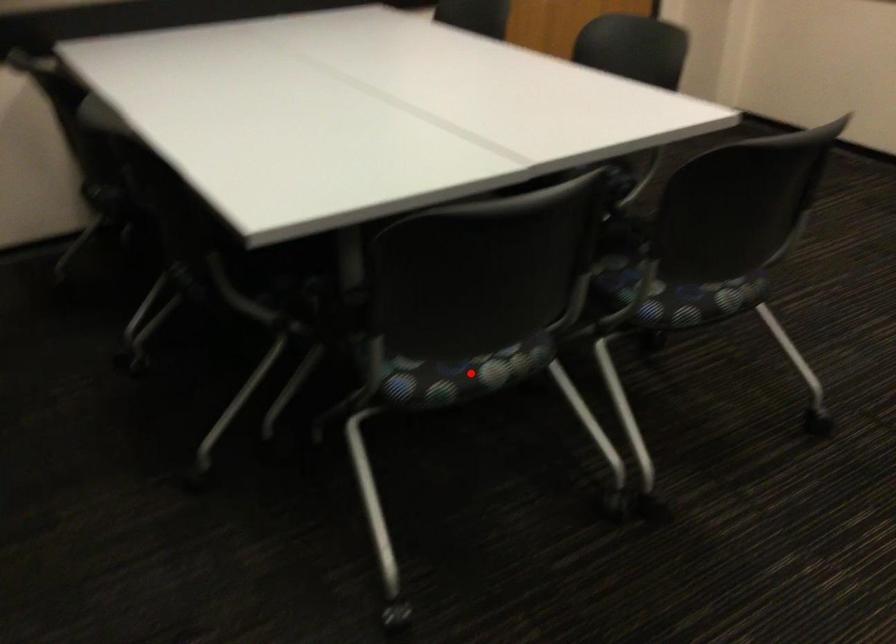
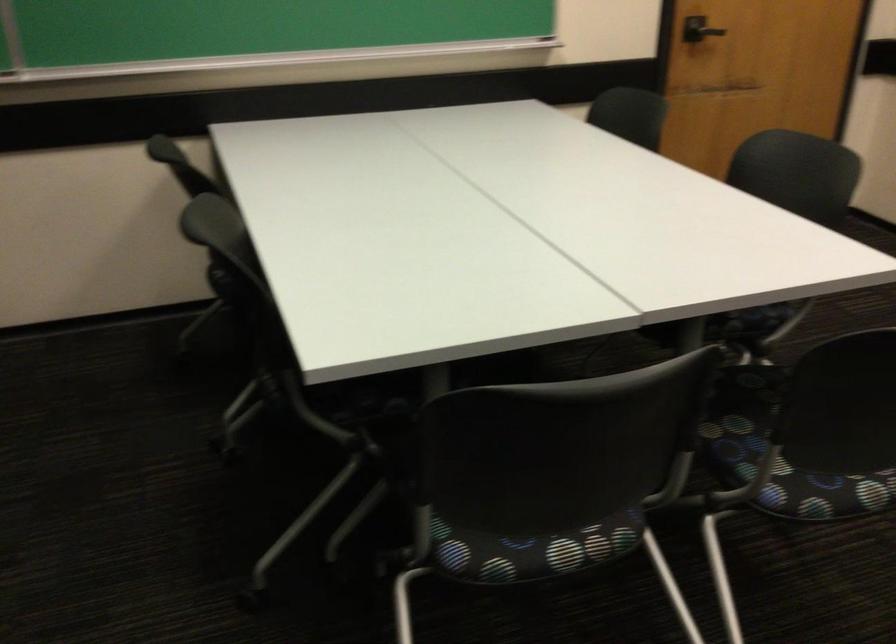
Question: I am providing you with two images of the same scene from different viewpoints. A red point is shown in image1. For the corresponding object point in image2, is it positioned nearer or farther from the camera?

Choices:
 (A) Nearer
 (B) Farther

Answer: (A)